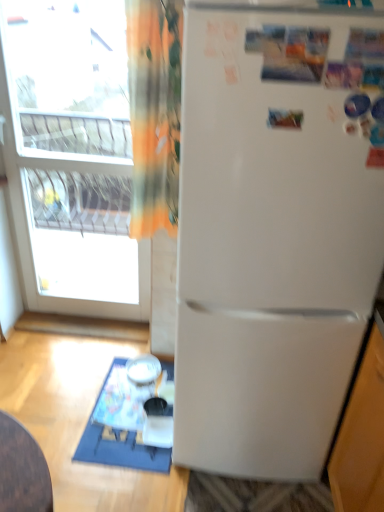
Question: Should I look upward or downward to see white plastic table at lower left?

Choices:
 (A) up
 (B) down

Answer: (B)

Question: From a real-world perspective, is orange fabric curtain at upper left located beneath white matte refrigerator at center?

Choices:
 (A) no
 (B) yes

Answer: (A)

Question: Is orange fabric curtain at upper left positioned before white matte refrigerator at center?

Choices:
 (A) yes
 (B) no

Answer: (B)

Question: Is orange fabric curtain at upper left bigger than white matte refrigerator at center?

Choices:
 (A) yes
 (B) no

Answer: (B)

Question: From the image's perspective, does orange fabric curtain at upper left appear higher than white matte refrigerator at center?

Choices:
 (A) no
 (B) yes

Answer: (B)

Question: Does orange fabric curtain at upper left have a lesser height compared to white matte refrigerator at center?

Choices:
 (A) yes
 (B) no

Answer: (A)

Question: Considering the relative sizes of orange fabric curtain at upper left and white matte refrigerator at center in the image provided, is orange fabric curtain at upper left thinner than white matte refrigerator at center?

Choices:
 (A) yes
 (B) no

Answer: (A)

Question: Can you confirm if white glossy bowl at lower center is thinner than white plastic table at lower left?

Choices:
 (A) no
 (B) yes

Answer: (B)

Question: Is white glossy bowl at lower center positioned with its back to white plastic table at lower left?

Choices:
 (A) yes
 (B) no

Answer: (B)

Question: Can you confirm if white glossy bowl at lower center is shorter than white plastic table at lower left?

Choices:
 (A) yes
 (B) no

Answer: (B)

Question: From the image's perspective, is white glossy bowl at lower center below white plastic table at lower left?

Choices:
 (A) yes
 (B) no

Answer: (B)

Question: Is white glossy bowl at lower center closer to camera compared to white plastic table at lower left?

Choices:
 (A) no
 (B) yes

Answer: (A)

Question: From a real-world perspective, is white glossy bowl at lower center under white plastic table at lower left?

Choices:
 (A) yes
 (B) no

Answer: (B)

Question: Is transparent glass window at upper left oriented away from white plastic table at lower left?

Choices:
 (A) yes
 (B) no

Answer: (B)